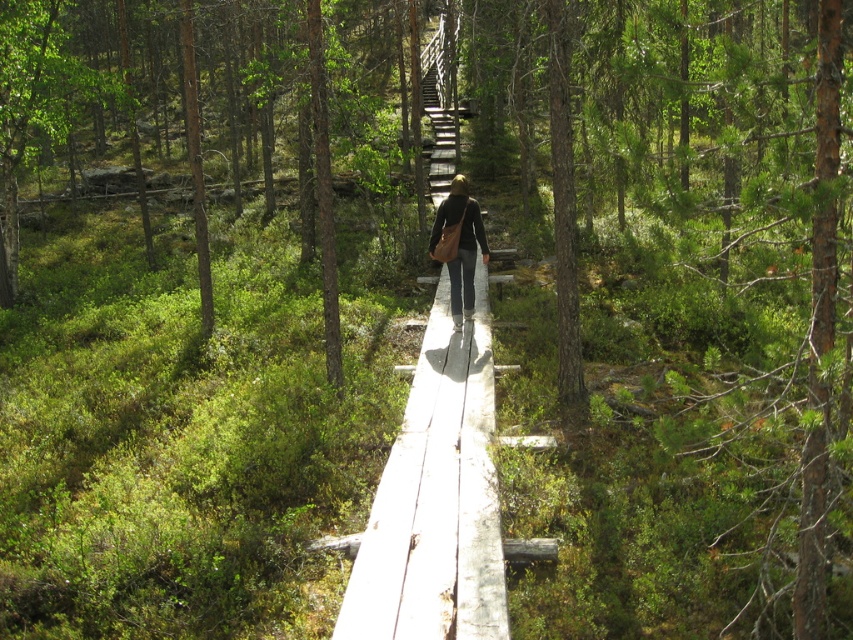
You are standing at the entrance of the boardwalk and see the wooden stairs at center. If you walk straight ahead, will you reach the stairs before the boardwalk ends?

The wooden stairs at center are located at point coordinates, but without knowing the boardwalk length or your starting position, I can only confirm their position. To determine reachability, more spatial data is needed.

You are a hiker carrying a wide backpack and need to cross the wooden boardwalk. The wooden plank at center and wooden stairs at center are part of your path. Which part of the path will be narrower for your backpack?

The wooden plank at center has a lesser width compared to wooden stairs at center, so the wooden plank at center will be narrower for your backpack.

You are a hiker walking on the wooden boardwalk in the forest. You notice a wooden plank at center and a brown leather bag at center. Which object is closer to you as you walk forward?

The wooden plank at center is closer to you because the brown leather bag at center is behind it.